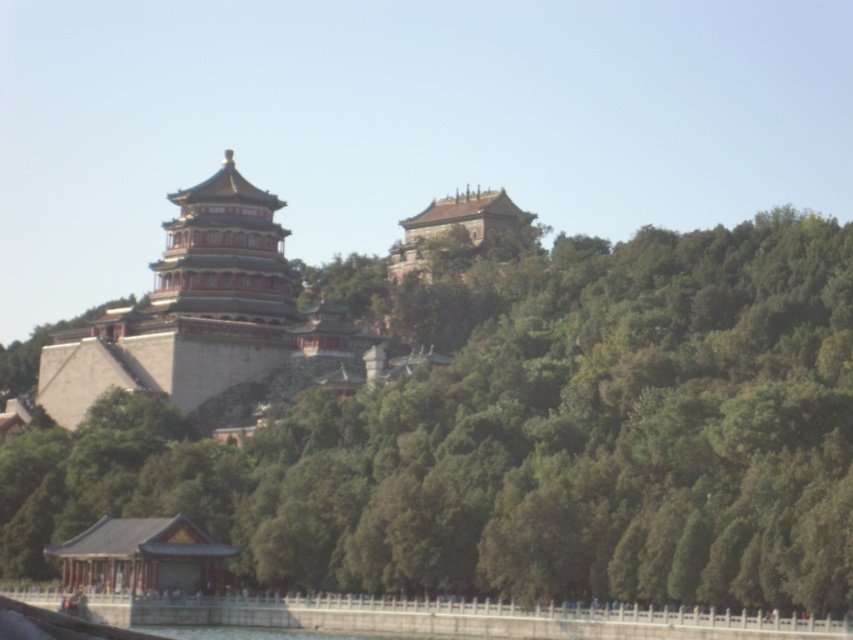
Question: Which object appears closest to the camera in this image?

Choices:
 (A) green stone pagoda at center
 (B) green leafy trees at center

Answer: (B)

Question: Does green leafy trees at center appear over green stone pagoda at center?

Choices:
 (A) no
 (B) yes

Answer: (A)

Question: Which point is closer to the camera?

Choices:
 (A) green stone pagoda at center
 (B) green leafy trees at center

Answer: (B)

Question: Which object is farther from the camera taking this photo?

Choices:
 (A) green leafy trees at center
 (B) green stone pagoda at center

Answer: (B)

Question: Can you confirm if green leafy trees at center is bigger than green stone pagoda at center?

Choices:
 (A) no
 (B) yes

Answer: (B)

Question: Can you confirm if green leafy trees at center is bigger than green stone pagoda at center?

Choices:
 (A) yes
 (B) no

Answer: (A)